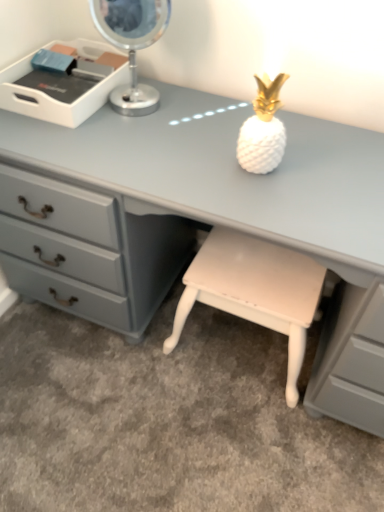
You are a GUI agent. You are given a task and a screenshot of the screen. Output one action in this format:
    pyautogui.click(x=<x>, y=<y>)
    Task: Click on the blank space above matte gray desk at center (from a real-world perspective)
    
    Given the screenshot: What is the action you would take?
    pyautogui.click(x=205, y=147)